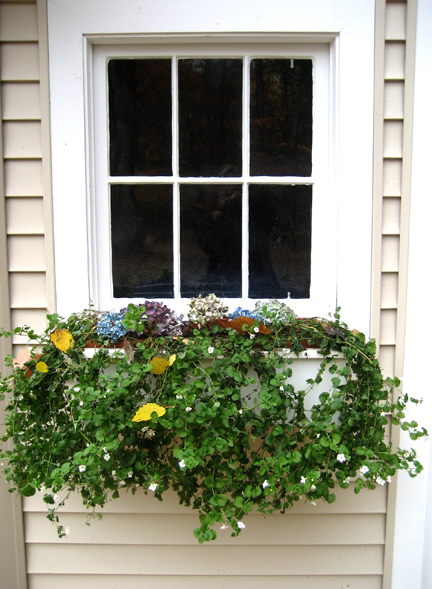
This screenshot has width=432, height=589. I want to click on windows in door, so point(140,155), point(219,157), point(281,166), point(269,214), point(217,248), point(139,244).